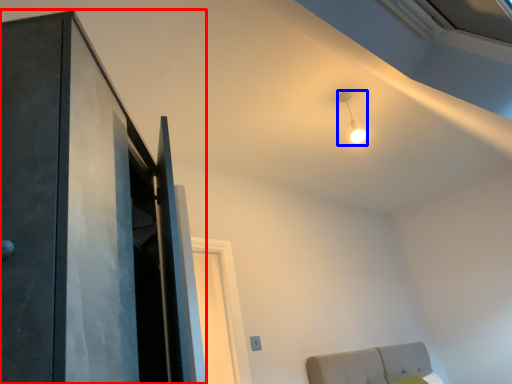
Question: Which object appears farthest to the camera in this image, door (highlighted by a red box) or light (highlighted by a blue box)?

Choices:
 (A) door
 (B) light

Answer: (B)